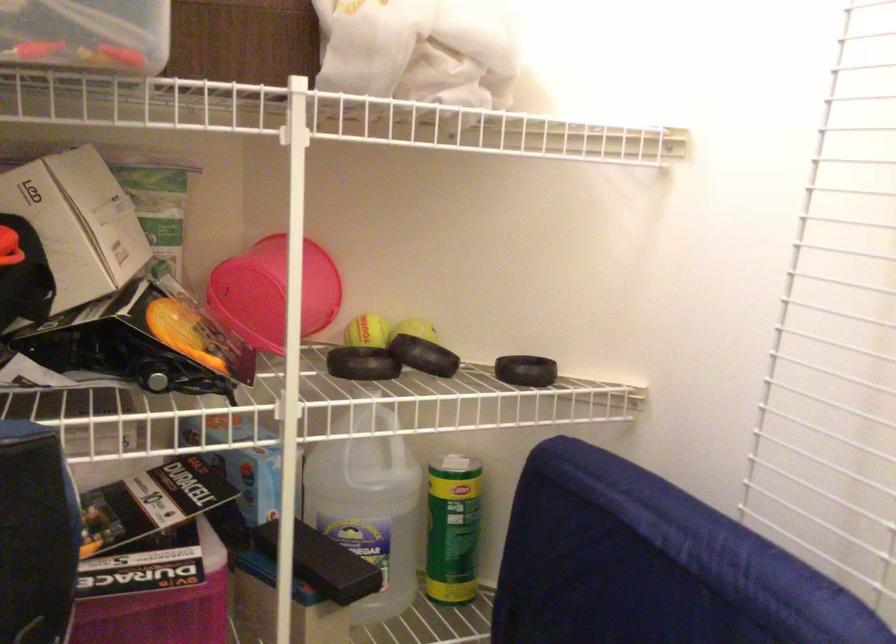
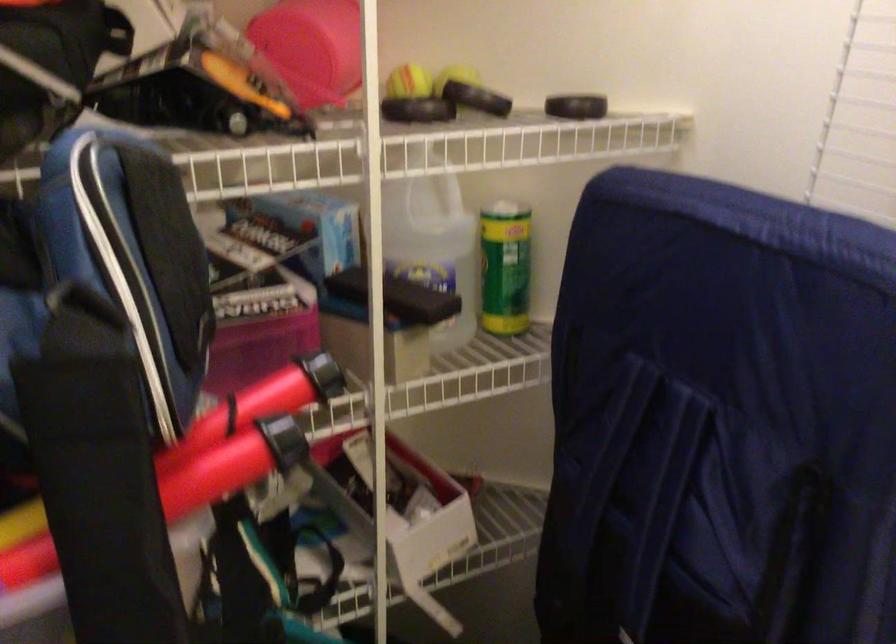
Question: The first image is from the beginning of the video and the second image is from the end. How did the camera likely rotate when shooting the video?

Choices:
 (A) Left
 (B) Right
 (C) Up
 (D) Down

Answer: (D)